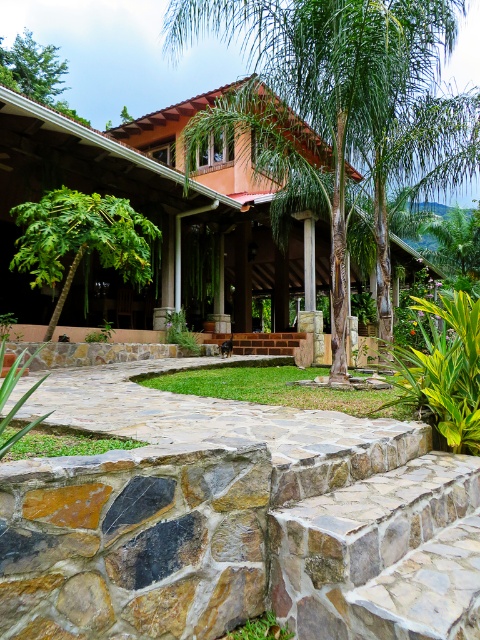
Question: Which point appears farthest from the camera in this image?

Choices:
 (A) (127, 198)
 (B) (13, 81)

Answer: (B)

Question: Can you confirm if green leafy palm tree at center is thinner than green leafy tree at left?

Choices:
 (A) yes
 (B) no

Answer: (B)

Question: Is green leafy palm tree at center further to the viewer compared to green leafy tree at upper left?

Choices:
 (A) yes
 (B) no

Answer: (B)

Question: Which object is closer to the camera taking this photo?

Choices:
 (A) green leafy palm tree at center
 (B) green leafy tree at left

Answer: (A)

Question: Which object is positioned farthest from the green leafy palm tree at center?

Choices:
 (A) green leafy tree at upper left
 (B) green leafy tree at left

Answer: (A)

Question: Can you confirm if green leafy tree at left is wider than green leafy tree at upper left?

Choices:
 (A) no
 (B) yes

Answer: (A)